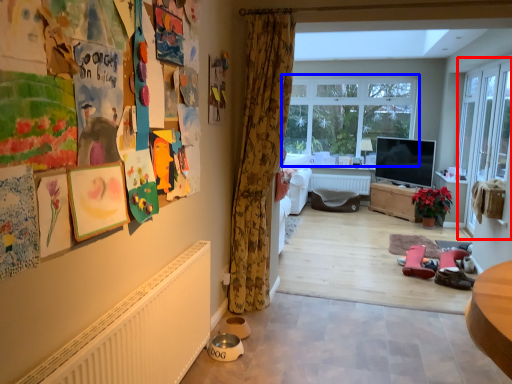
Question: Which point is closer to the camera, screen door (highlighted by a red box) or window (highlighted by a blue box)?

Choices:
 (A) screen door
 (B) window

Answer: (A)